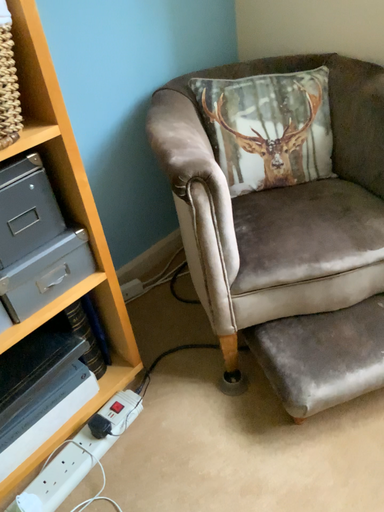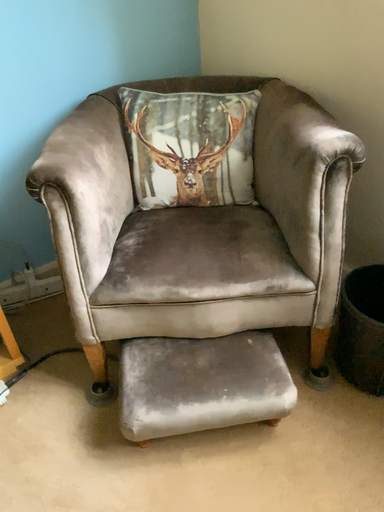
Question: Which way did the camera rotate in the video?

Choices:
 (A) rotated right
 (B) rotated left

Answer: (B)